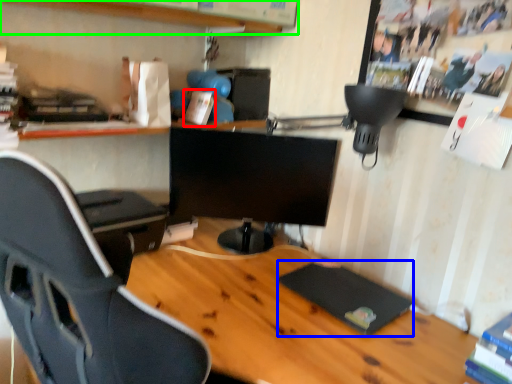
Question: Which object is positioned farthest from book (highlighted by a red box)? Select from pad (highlighted by a blue box) and shelf (highlighted by a green box).

Choices:
 (A) pad
 (B) shelf

Answer: (A)